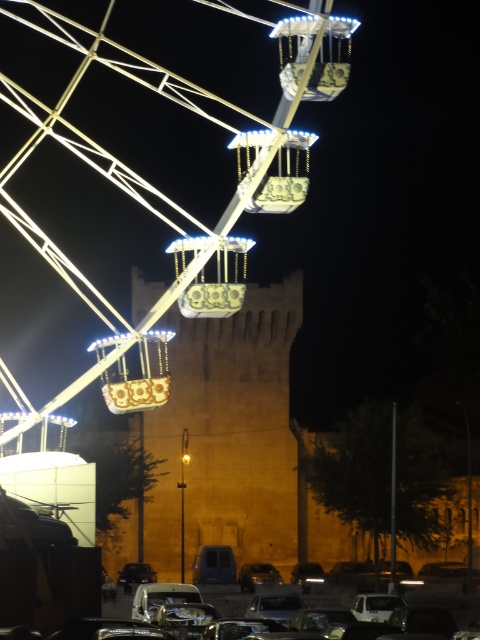
You are a photographer standing in the middle of the scene. You want to take a photo that includes both the yellow stone tower at center and the shiny silver car at center. Which object should you position to the left side of the other to include both in your frame?

To include both the yellow stone tower at center and the shiny silver car at center in your frame, you should position the yellow stone tower at center to the left side of the shiny silver car at center because the yellow stone tower at center is already positioned on the left side of the shiny silver car at center according to the scene description.

You are planning to install a new light pole between the yellow stone tower at center and the illuminated metal ferris wheel at center. The light pole requires a minimum of 50 feet of space between the two structures to be installed safely. Based on the distance provided, is it feasible to install the light pole between them?

The yellow stone tower at center is 77.85 feet from the illuminated metal ferris wheel at center. Since the required minimum space is 50 feet, the distance between them is sufficient to install the light pole safely between the yellow stone tower at center and the illuminated metal ferris wheel at center.